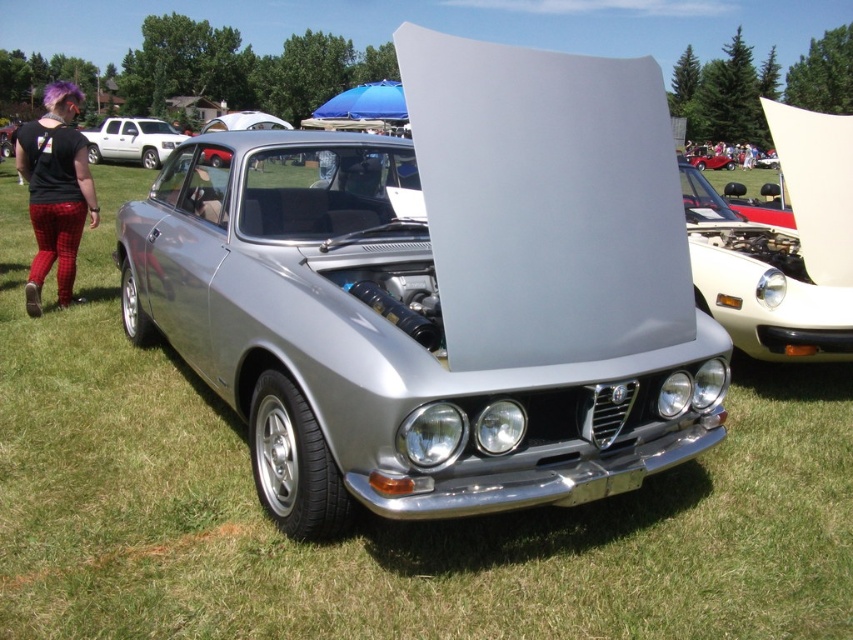
Question: Which object is the closest to the white matte truck at upper left?

Choices:
 (A) white glossy car at center
 (B) plaid fabric pants at left

Answer: (B)

Question: Which of the following is the closest to the observer?

Choices:
 (A) (207, 154)
 (B) (132, 134)
 (C) (33, 296)
 (D) (805, 275)

Answer: (A)

Question: Can you confirm if plaid fabric pants at left is bigger than metallic red car at center?

Choices:
 (A) yes
 (B) no

Answer: (A)

Question: Estimate the real-world distances between objects in this image. Which object is closer to the satin silver car at center?

Choices:
 (A) white matte truck at upper left
 (B) metallic red car at center

Answer: (A)

Question: Where is plaid fabric pants at left located in relation to satin silver car at center in the image?

Choices:
 (A) below
 (B) above

Answer: (B)

Question: Is white glossy car at center behind satin silver car at center?

Choices:
 (A) no
 (B) yes

Answer: (B)